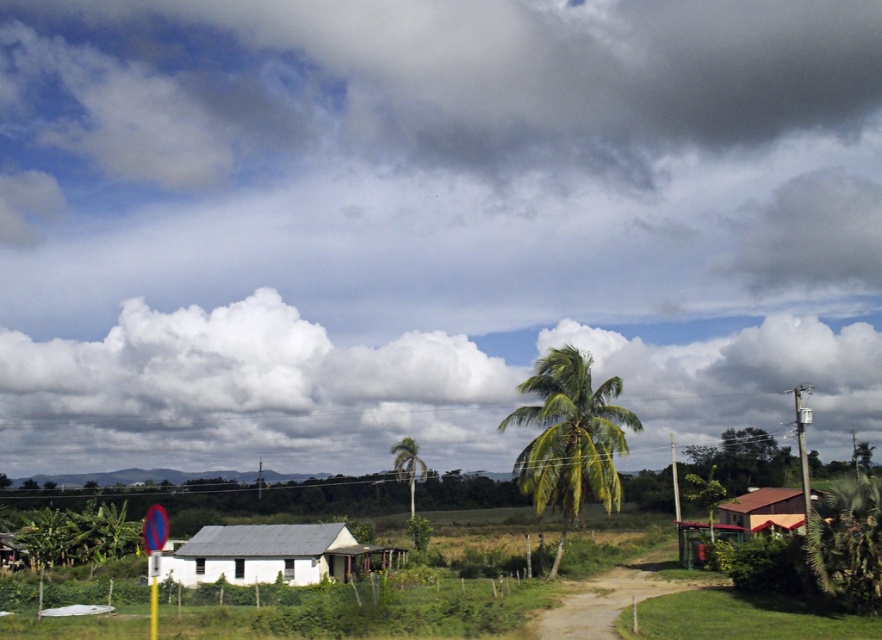
Question: Which object appears closest to the camera in this image?

Choices:
 (A) white plastic utility pole at right
 (B) brown dirt track at lower right
 (C) white matte hut at lower left
 (D) brown corrugated roof hut at lower right

Answer: (B)

Question: Is the position of brown corrugated roof hut at lower right less distant than that of green wooden pole at right?

Choices:
 (A) no
 (B) yes

Answer: (B)

Question: Which object is closer to the camera taking this photo?

Choices:
 (A) white matte hut at center
 (B) green wooden pole at right
 (C) brown corrugated roof hut at lower right
 (D) white matte hut at lower left

Answer: (C)

Question: Does white matte hut at lower left come behind green wooden pole at right?

Choices:
 (A) no
 (B) yes

Answer: (B)

Question: Is brown dirt track at lower right positioned before brown corrugated roof hut at lower right?

Choices:
 (A) no
 (B) yes

Answer: (B)

Question: Among these objects, which one is farthest from the camera?

Choices:
 (A) green leafy palm at center
 (B) brown dirt track at lower right
 (C) white matte hut at center

Answer: (C)